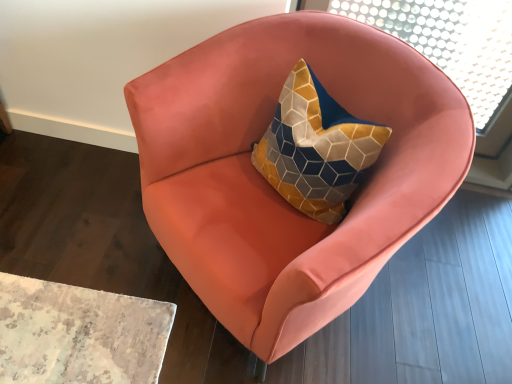
Where is `free space to the left of satin coral armchair at center`? This screenshot has height=384, width=512. free space to the left of satin coral armchair at center is located at coordinates (83, 246).